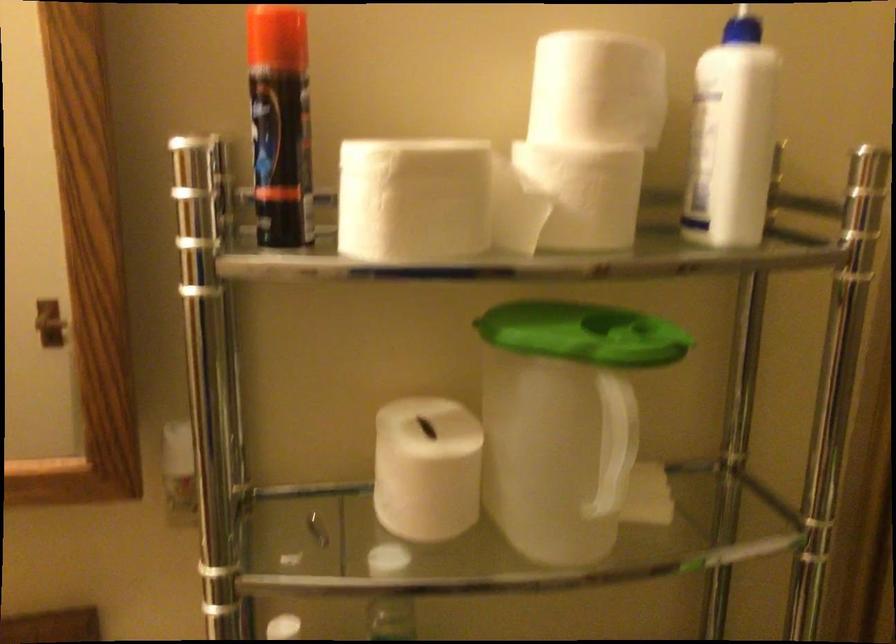
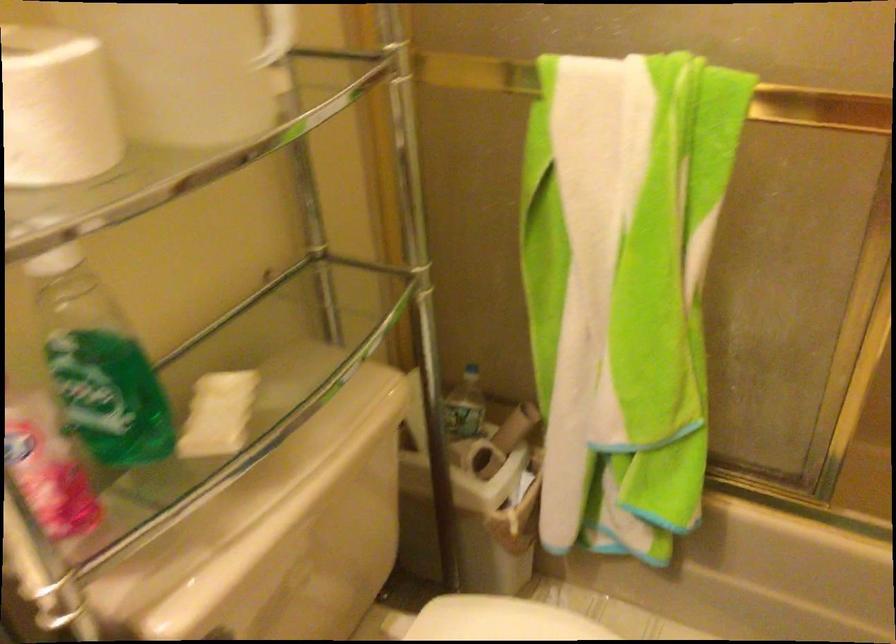
In the second image, find the point that corresponds to point (672, 476) in the first image.

(270, 64)